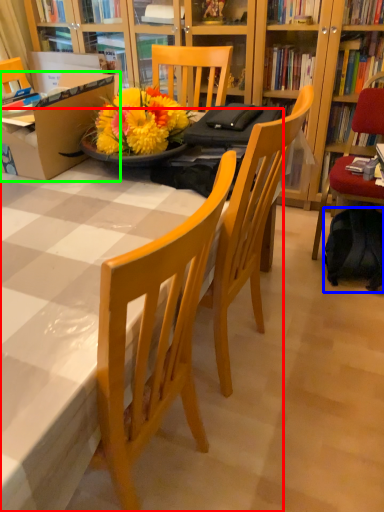
Question: Which object is the farthest from desk (highlighted by a red box)? Choose among these: backpack (highlighted by a blue box) or box (highlighted by a green box).

Choices:
 (A) backpack
 (B) box

Answer: (A)